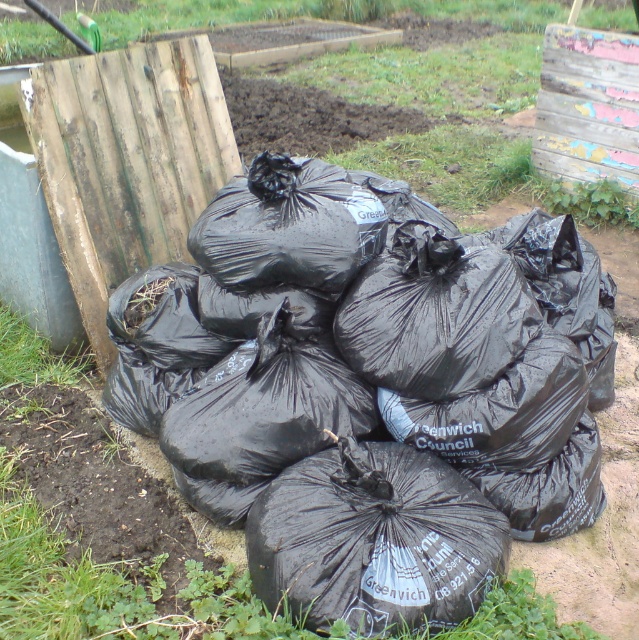
Does black plastic bags at center appear over green grass at upper center?

Incorrect, black plastic bags at center is not positioned above green grass at upper center.

Which is behind, point (458, 289) or point (164, 8)?

The point (164, 8) is more distant.

Locate an element on the screen. This screenshot has width=639, height=640. black plastic bags at center is located at coordinates (348, 349).

Does black plastic bags at center appear under black plastic sack at center?

No.

Which is below, black plastic bags at center or black plastic sack at center?

black plastic sack at center

Between point (242, 257) and point (426, 544), which one is positioned in front?

Point (426, 544) is in front.

At what (x,y) coordinates should I click in order to perform the action: click on black plastic bags at center. Please return your answer as a coordinate pair (x, y). The height and width of the screenshot is (640, 639). Looking at the image, I should click on (348, 349).

Does black plastic sack at center appear on the left side of green grass at upper center?

In fact, black plastic sack at center is to the right of green grass at upper center.

Between black plastic sack at center and green grass at upper center, which one appears on the right side from the viewer's perspective?

From the viewer's perspective, black plastic sack at center appears more on the right side.

Is point (381, 547) farther from camera compared to point (42, 35)?

That is False.

Locate an element on the screen. black plastic sack at center is located at coordinates click(373, 540).